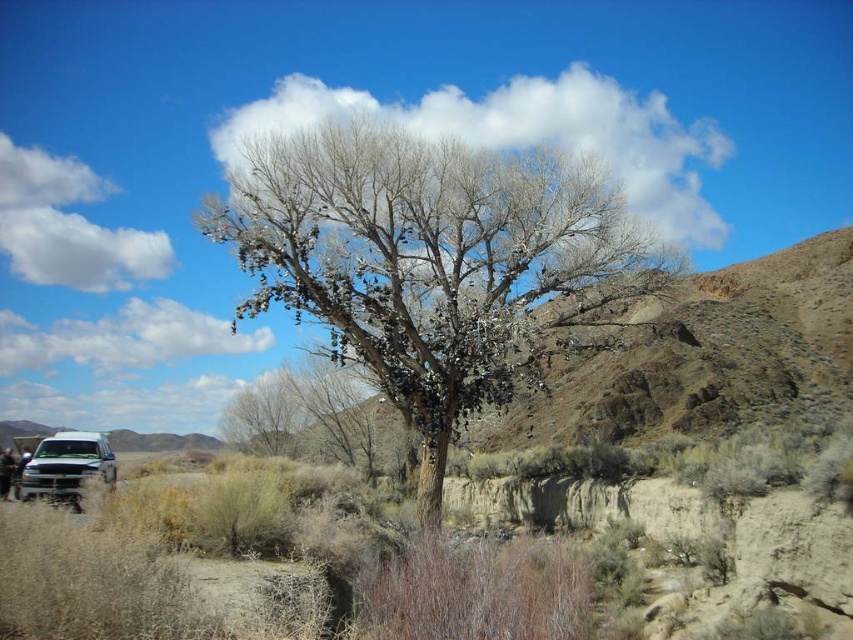
Question: Which point is closer to the camera?

Choices:
 (A) gray bark tree at center
 (B) silver metallic truck at lower left

Answer: (B)

Question: Can you confirm if bare branches at center is smaller than gray bark tree at center?

Choices:
 (A) no
 (B) yes

Answer: (A)

Question: Where is silver metallic truck at lower left located in relation to gray bark tree at center in the image?

Choices:
 (A) above
 (B) below

Answer: (B)

Question: Is bare branches at center in front of gray bark tree at center?

Choices:
 (A) yes
 (B) no

Answer: (A)

Question: Among these points, which one is nearest to the camera?

Choices:
 (A) (59, 488)
 (B) (444, 476)
 (C) (279, 412)

Answer: (A)

Question: Estimate the real-world distances between objects in this image. Which object is farther from the gray bark tree at center?

Choices:
 (A) bare branches at center
 (B) silver metallic truck at lower left

Answer: (A)